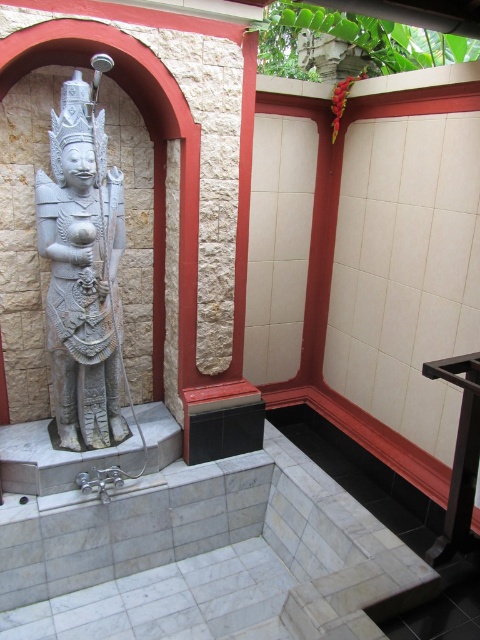
Which is in front, point (104, 397) or point (456, 476)?

Point (456, 476) is more forward.

Describe the element at coordinates (84, 268) in the screenshot. This screenshot has width=480, height=640. I see `gray stone statue at left` at that location.

I want to click on gray stone statue at left, so click(x=84, y=268).